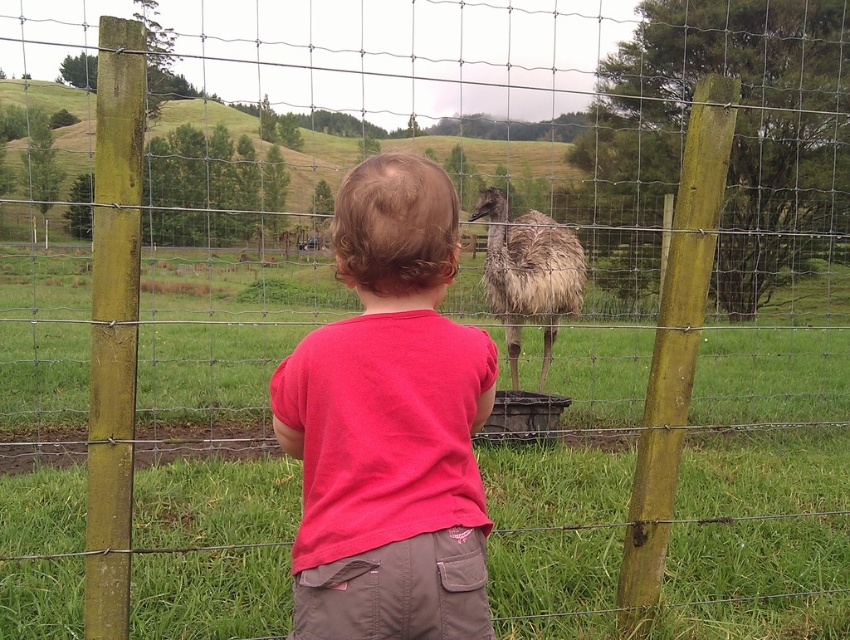
Does pink cotton shirt at center appear on the right side of brown feathered ostrich at center?

In fact, pink cotton shirt at center is to the left of brown feathered ostrich at center.

Which is above, pink cotton shirt at center or brown feathered ostrich at center?

brown feathered ostrich at center is above.

Is point (429, 208) positioned behind point (494, 304)?

No, (429, 208) is closer to viewer.

Locate an element on the screen. The width and height of the screenshot is (850, 640). pink cotton shirt at center is located at coordinates (389, 424).